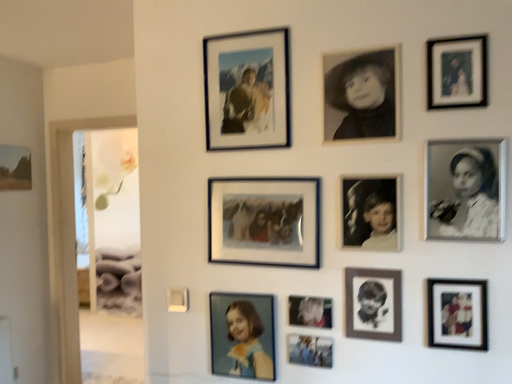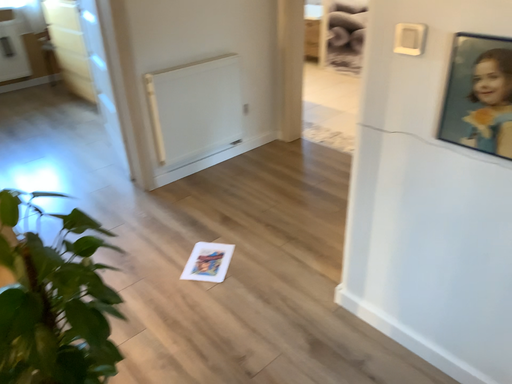
Question: How did the camera likely rotate when shooting the video?

Choices:
 (A) rotated right
 (B) rotated left

Answer: (B)